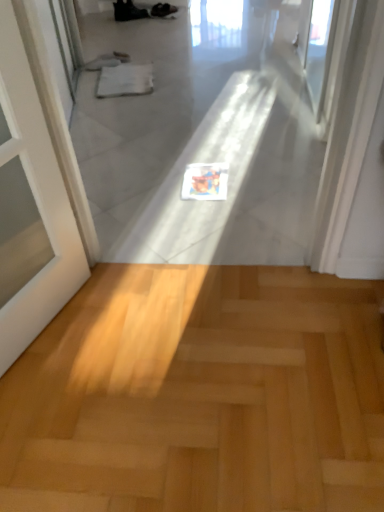
This screenshot has width=384, height=512. I want to click on vacant area on top of light wood stairs at center (from a real-world perspective), so click(x=191, y=365).